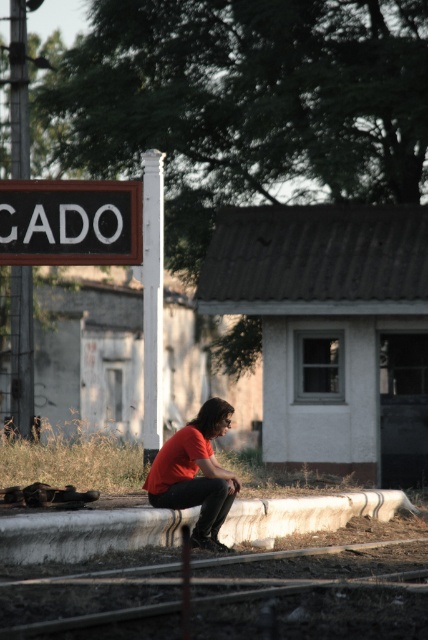
You are a traveler who just arrived at the train station and need to read the black painted wood sign at upper left. However, you are currently standing next to the matte red shirt at center. Can you read the sign without moving closer?

The black painted wood sign at upper left is larger in size than the matte red shirt at center. Since the sign is larger, it should be readable from a distance if its text is proportionally sized. However, without knowing the exact text size, it is uncertain. But based on size alone, it might be possible to read the sign without moving closer.

Consider the image. You are a maintenance worker inspecting the train station platform. You notice the smooth concrete train track at lower center and the black painted wood sign at upper left. Which object appears to be physically smaller in the image?

The smooth concrete train track at lower center is smaller than the black painted wood sign at upper left, so the smooth concrete train track at lower center appears physically smaller in the image.